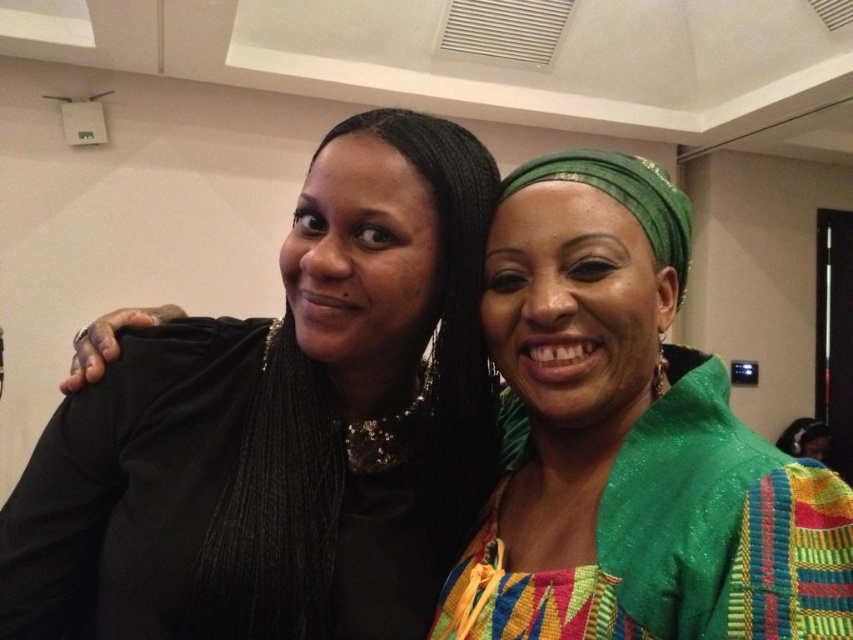
Question: Which point is closer to the camera?

Choices:
 (A) (322, 417)
 (B) (573, 221)

Answer: (B)

Question: Which object appears farthest from the camera in this image?

Choices:
 (A) green woven fabric at center
 (B) black velvet sweater at left

Answer: (B)

Question: Is black velvet sweater at left bigger than green woven fabric at center?

Choices:
 (A) no
 (B) yes

Answer: (B)

Question: Does black velvet sweater at left appear on the left side of green woven fabric at center?

Choices:
 (A) no
 (B) yes

Answer: (B)

Question: Which point is closer to the camera?

Choices:
 (A) black velvet sweater at left
 (B) green woven fabric at center

Answer: (B)

Question: Is black velvet sweater at left below green woven fabric at center?

Choices:
 (A) no
 (B) yes

Answer: (B)